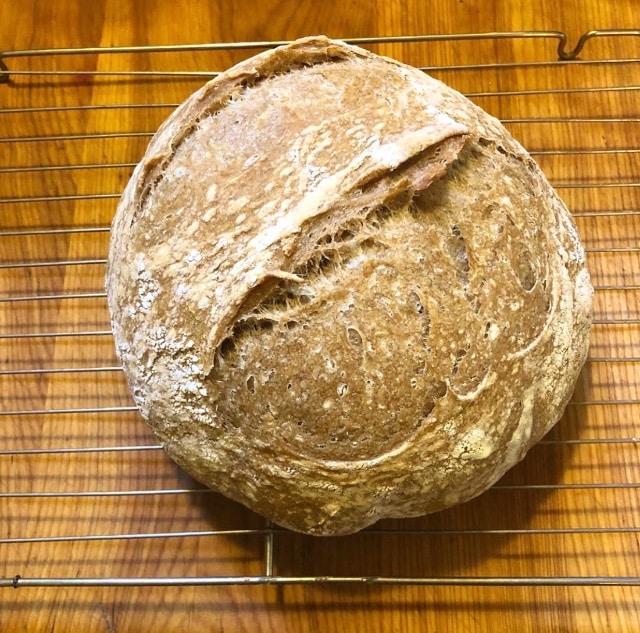
Identify the location of rack touching table top. (573, 57).